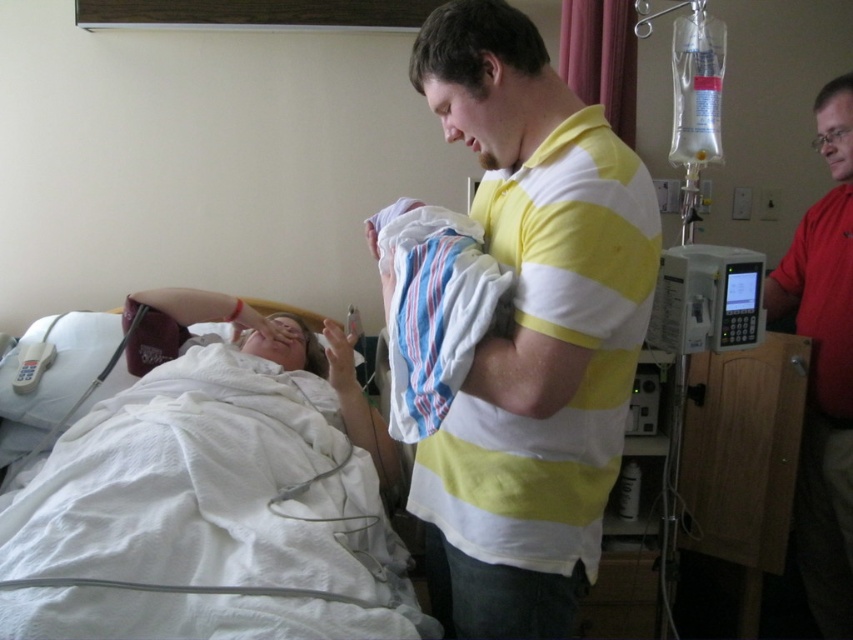
Question: Considering the relative positions of red shirt at right and striped cotton blanket at center in the image provided, where is red shirt at right located with respect to striped cotton blanket at center?

Choices:
 (A) left
 (B) right

Answer: (B)

Question: Can you confirm if yellow striped shirt at center is smaller than striped cotton blanket at center?

Choices:
 (A) no
 (B) yes

Answer: (A)

Question: Does yellow striped shirt at center appear on the left side of white fabric bed at upper left?

Choices:
 (A) no
 (B) yes

Answer: (A)

Question: Which point is farther to the camera?

Choices:
 (A) (836, 237)
 (B) (555, 257)
 (C) (399, 323)

Answer: (A)

Question: Which is nearer to the red shirt at right?

Choices:
 (A) yellow striped shirt at center
 (B) striped cotton blanket at center
 (C) white fabric bed at upper left

Answer: (A)

Question: Estimate the real-world distances between objects in this image. Which object is closer to the striped cotton blanket at center?

Choices:
 (A) red shirt at right
 (B) yellow striped shirt at center

Answer: (B)